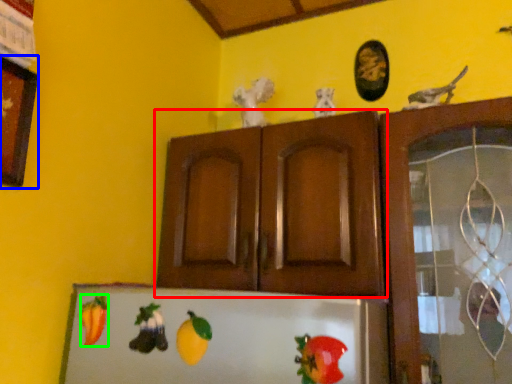
Question: Considering the real-world distances, which object is farthest from cabinetry (highlighted by a red box)? picture frame (highlighted by a blue box) or fruit (highlighted by a green box)?

Choices:
 (A) picture frame
 (B) fruit

Answer: (A)